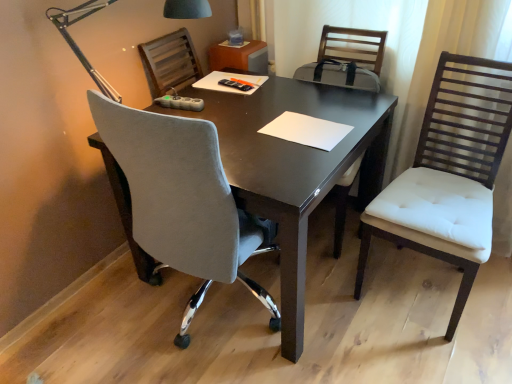
This screenshot has height=384, width=512. Find the location of `unoccupied region to the right of metallic gray lamp at upper left`. unoccupied region to the right of metallic gray lamp at upper left is located at coordinates (253, 131).